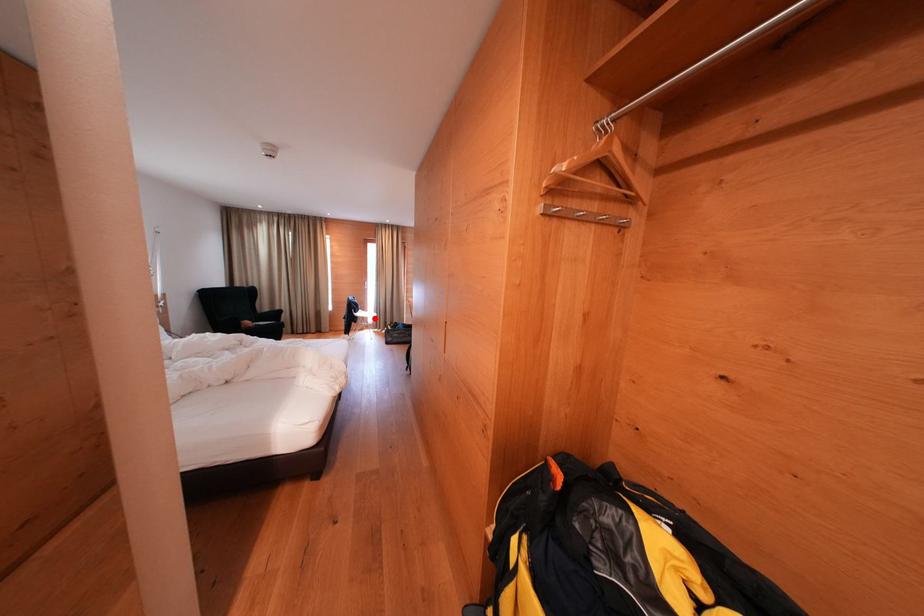
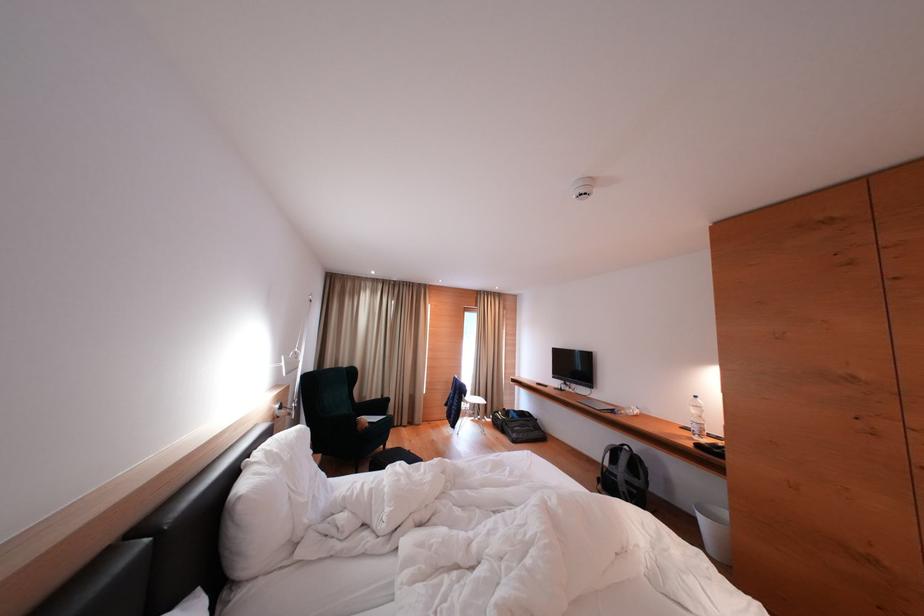
Where in the second image is the point corresponding to the highlighted location from the first image?

(477, 402)